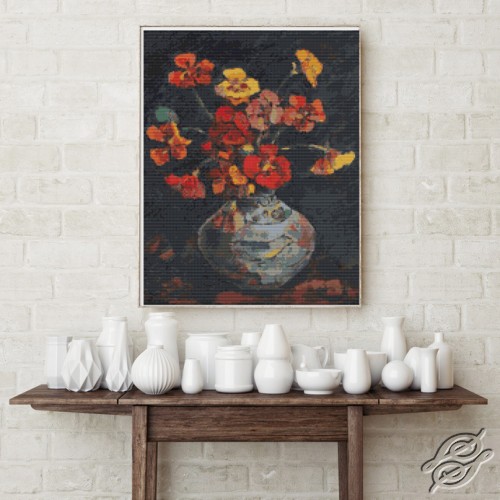
At what (x,y) coordinates should I click in order to perform the action: click on vase. Please return your answer as a coordinate pair (x, y). Looking at the image, I should click on (87, 373).